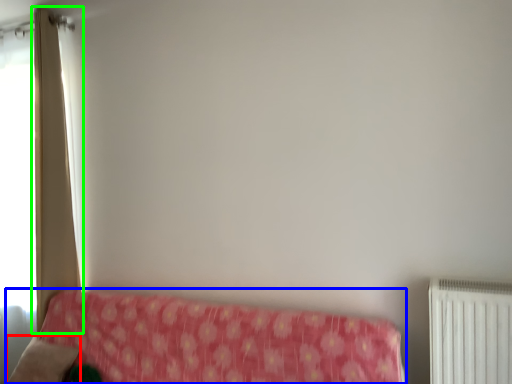
Question: Estimate the real-world distances between objects in this image. Which object is farther from pillow (highlighted by a red box), furniture (highlighted by a blue box) or curtain (highlighted by a green box)?

Choices:
 (A) furniture
 (B) curtain

Answer: (B)